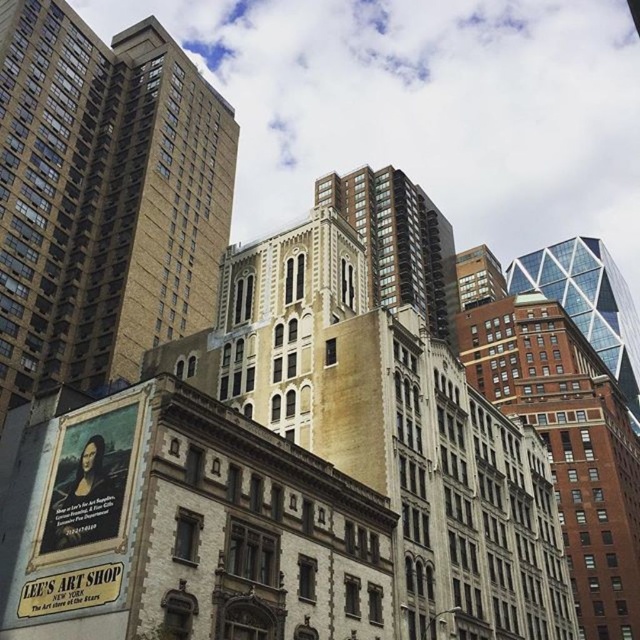
Who is taller, beige stone building at left or glassy steel skyscraper at upper right?

beige stone building at left

Between point (173, 106) and point (509, 280), which one is positioned in front?

Point (173, 106) is in front.

The image size is (640, 640). I want to click on beige stone building at left, so click(x=102, y=196).

Does gold brick building at center have a larger size compared to glassy steel skyscraper at upper right?

No, gold brick building at center is not bigger than glassy steel skyscraper at upper right.

Can you confirm if gold brick building at center is smaller than glassy steel skyscraper at upper right?

Indeed, gold brick building at center has a smaller size compared to glassy steel skyscraper at upper right.

Identify the location of gold brick building at center. The image size is (640, 640). (397, 241).

Find the location of `gold brick building at center`. gold brick building at center is located at coordinates (397, 241).

Is point (632, 596) positioned before point (534, 289)?

That is True.

Is point (595, 376) positioned after point (552, 298)?

No, it is not.

The image size is (640, 640). What are the coordinates of `brown brick building at center-right` in the screenshot? It's located at (566, 444).